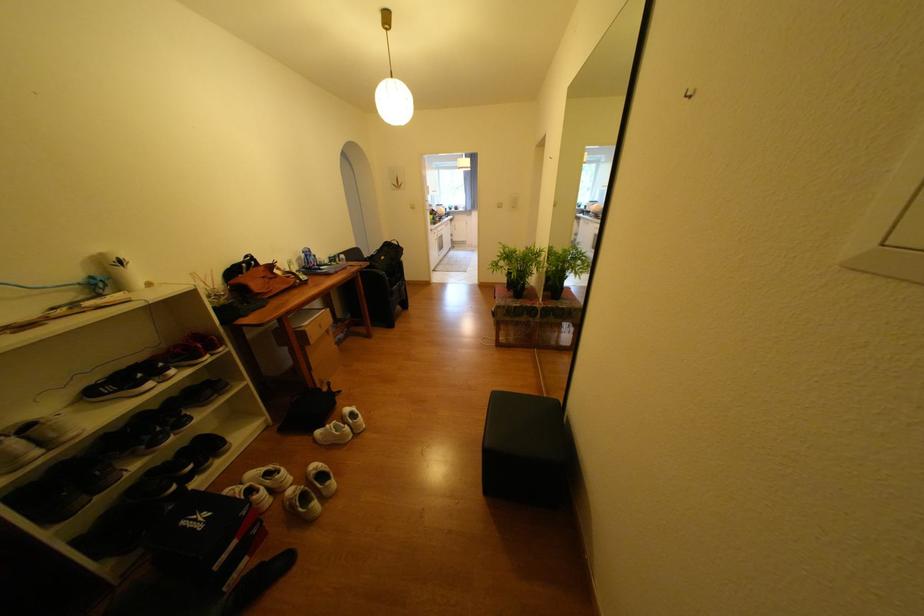
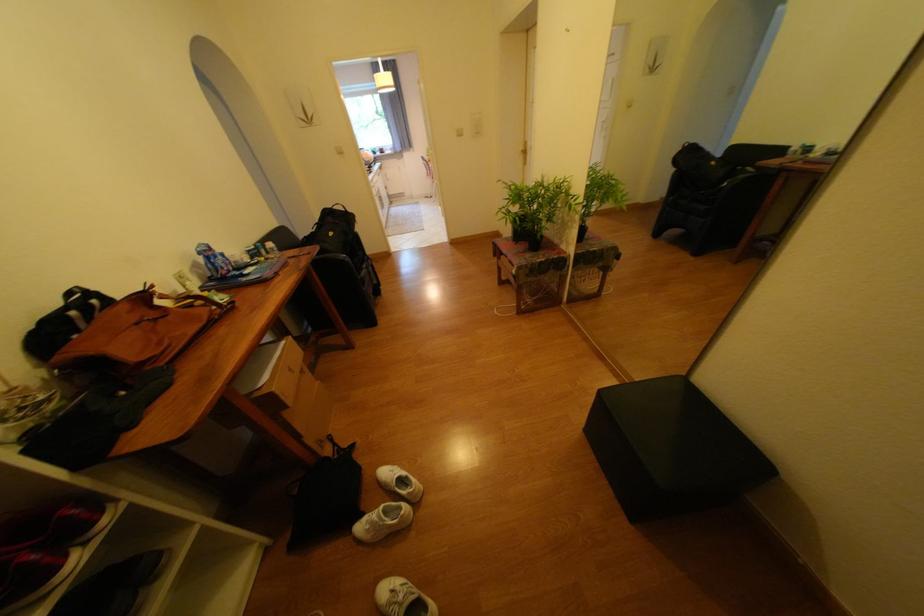
The images are taken continuously from a first-person perspective. In which direction are you moving?

The movement direction of the cameraman is left, forward.